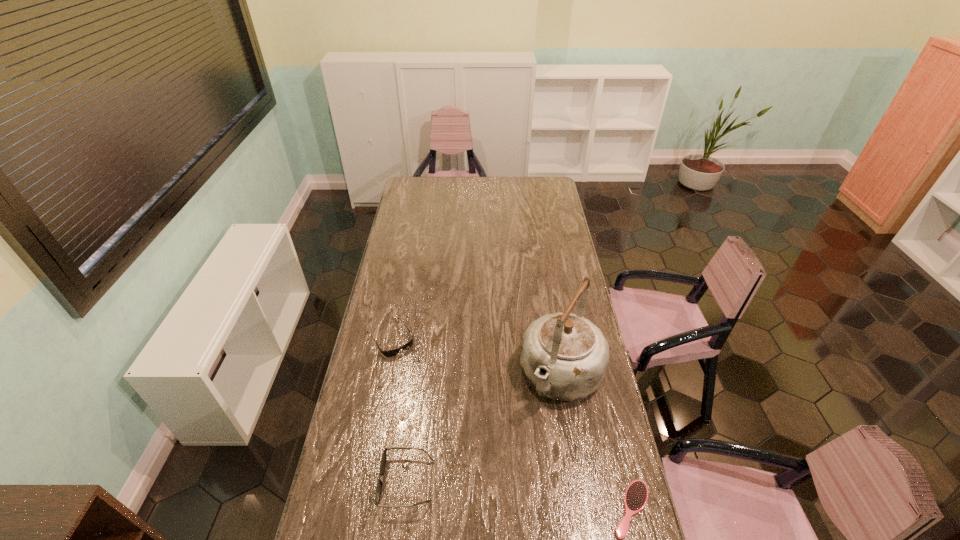
In order to click on vacant space on the desktop that is between the nearer sunglasses and the shortest object and is positioned on the front-facing side of the farther sunglasses in this screenshot , I will do `click(494, 492)`.

The width and height of the screenshot is (960, 540). I want to click on vacant space on the desktop that is between the nearer sunglasses and the shortest object and is positioned at the spout of the kettle, so click(495, 492).